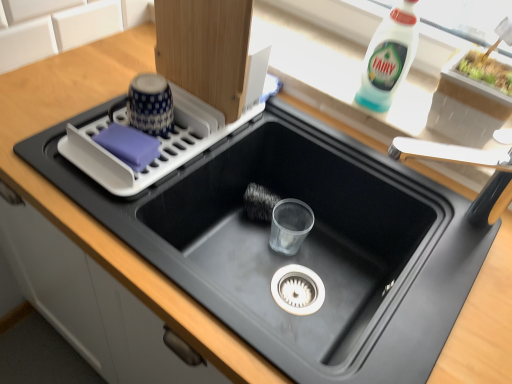
Question: Is black matte sink at center aimed at white plastic dish rack at upper left?

Choices:
 (A) yes
 (B) no

Answer: (B)

Question: From the image's perspective, would you say black matte sink at center is shown under white plastic dish rack at upper left?

Choices:
 (A) no
 (B) yes

Answer: (B)

Question: Is black matte sink at center at the left side of white plastic dish rack at upper left?

Choices:
 (A) no
 (B) yes

Answer: (A)

Question: Is black matte sink at center bigger than white plastic dish rack at upper left?

Choices:
 (A) no
 (B) yes

Answer: (B)

Question: Does black matte sink at center lie in front of white plastic dish rack at upper left?

Choices:
 (A) yes
 (B) no

Answer: (A)

Question: Does black matte sink at center have a lesser width compared to white plastic dish rack at upper left?

Choices:
 (A) no
 (B) yes

Answer: (A)

Question: From the image's perspective, does black matte sink at center appear higher than white plastic faucet at upper right?

Choices:
 (A) yes
 (B) no

Answer: (B)

Question: Is black matte sink at center next to white plastic faucet at upper right and touching it?

Choices:
 (A) yes
 (B) no

Answer: (B)

Question: Is black matte sink at center taller than white plastic faucet at upper right?

Choices:
 (A) yes
 (B) no

Answer: (A)

Question: Does black matte sink at center turn towards white plastic faucet at upper right?

Choices:
 (A) yes
 (B) no

Answer: (B)

Question: Is black matte sink at center further to camera compared to white plastic faucet at upper right?

Choices:
 (A) yes
 (B) no

Answer: (B)

Question: Is black matte sink at center positioned beyond the bounds of white plastic faucet at upper right?

Choices:
 (A) yes
 (B) no

Answer: (A)

Question: From the image's perspective, is white plastic bottle at upper right located above black matte sink at center?

Choices:
 (A) yes
 (B) no

Answer: (A)